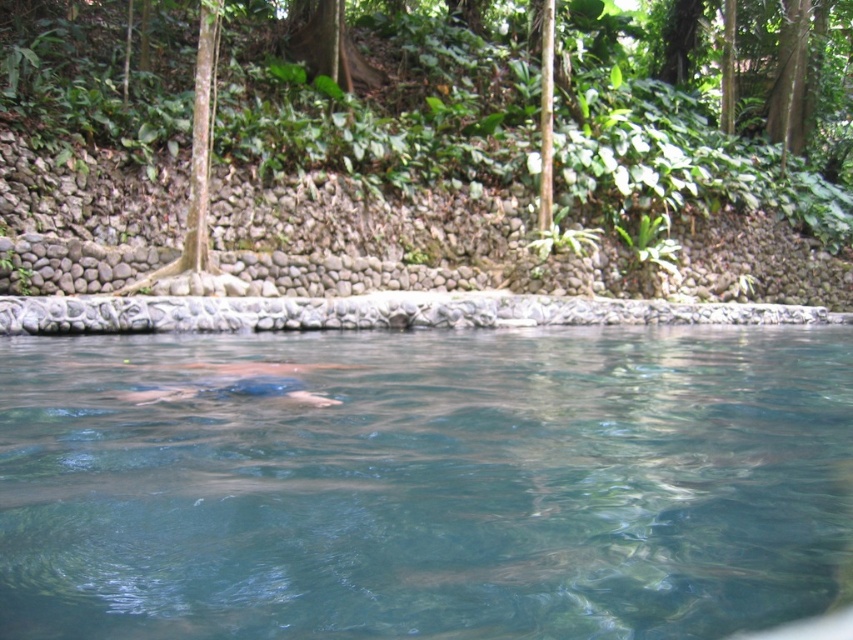
You are a swimmer who wants to retrieve an object from the pool. You see the clear water at center and the blue fabric at center. Which object is submerged underwater?

The clear water at center is located below the blue fabric at center, so the submerged object is the clear water at center.

You are standing at the edge of the pool and want to see the clear water at center. In which direction should you look to see it?

You should look towards the center of the pool to see the clear water at center.

You are standing at the edge of the pool and see the clear water at center and the blue fabric at center. Which object is closer to you?

The clear water at center is closer to the viewer than the blue fabric at center.